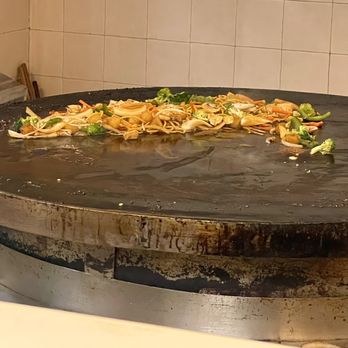
Where is `tiles`? tiles is located at coordinates (162, 48), (125, 59), (212, 59).